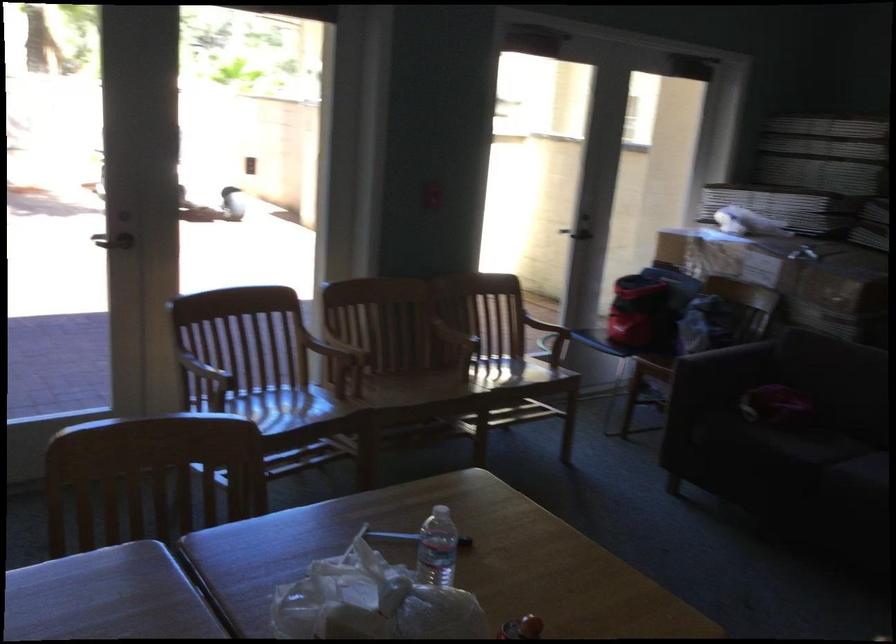
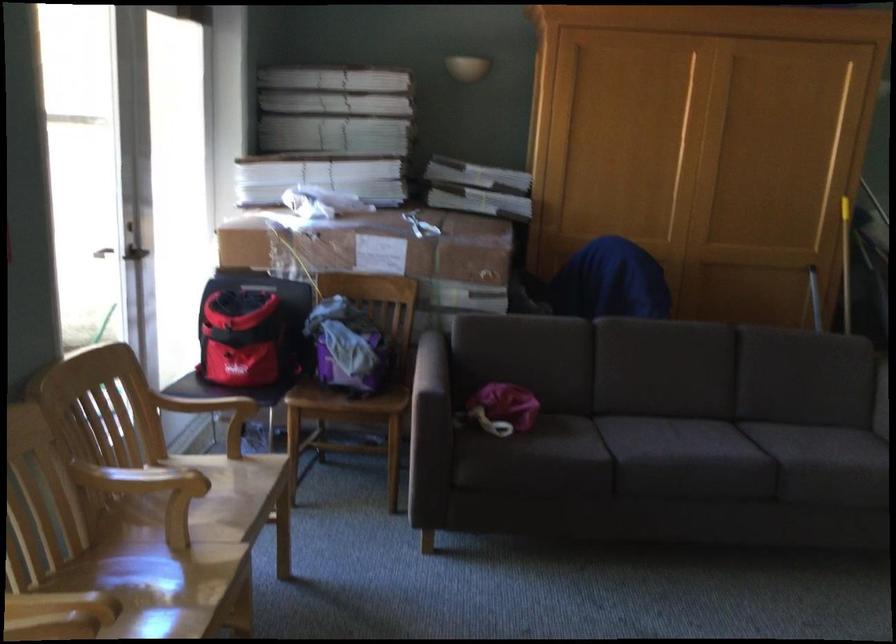
Where in the second image is the point corresponding to point 735,345 from the first image?

(431, 365)